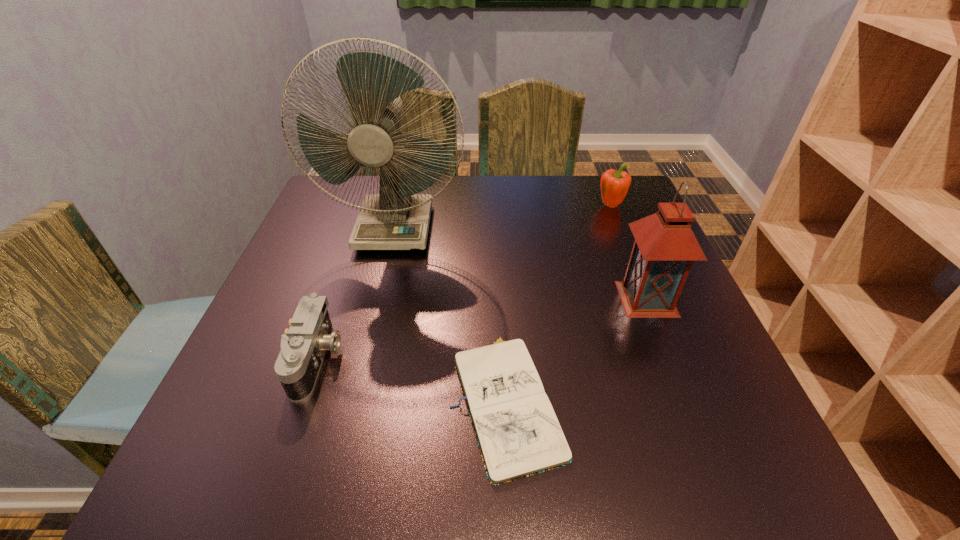
The image size is (960, 540). Identify the location of empty space between the lantern and the third tallest object. (629, 252).

Find the location of a particular element. empty location between the fan and the pepper is located at coordinates (503, 217).

Where is `free space between the notebook and the tallest object`? The width and height of the screenshot is (960, 540). free space between the notebook and the tallest object is located at coordinates (450, 314).

You are a GUI agent. You are given a task and a screenshot of the screen. Output one action in this format:
    pyautogui.click(x=<x>, y=<y>)
    Task: Click on the unoccupied position between the third farthest object and the third shortest object
    Image resolution: width=960 pixels, height=540 pixels.
    Given the screenshot: What is the action you would take?
    pyautogui.click(x=629, y=252)

Locate an element on the screen. vacant region between the third shortest object and the notebook is located at coordinates (559, 302).

In order to click on object identified as the second closest to the camera in this screenshot , I will do `click(397, 218)`.

Image resolution: width=960 pixels, height=540 pixels. In order to click on object that is the third closest to the pepper in this screenshot , I will do `click(517, 431)`.

Where is `free space that satisfies the following two spatial constraints: 1. on the back side of the fourth shortest object; 2. on the right side of the pepper`? Image resolution: width=960 pixels, height=540 pixels. free space that satisfies the following two spatial constraints: 1. on the back side of the fourth shortest object; 2. on the right side of the pepper is located at coordinates (610, 206).

Identify the location of vacant area that satisfies the following two spatial constraints: 1. on the front-facing side of the tallest object; 2. on the lens of the second shortest object. (364, 359).

Locate an element on the screen. This screenshot has height=540, width=960. vacant space that satisfies the following two spatial constraints: 1. on the front-facing side of the lantern; 2. on the left side of the fan is located at coordinates (378, 299).